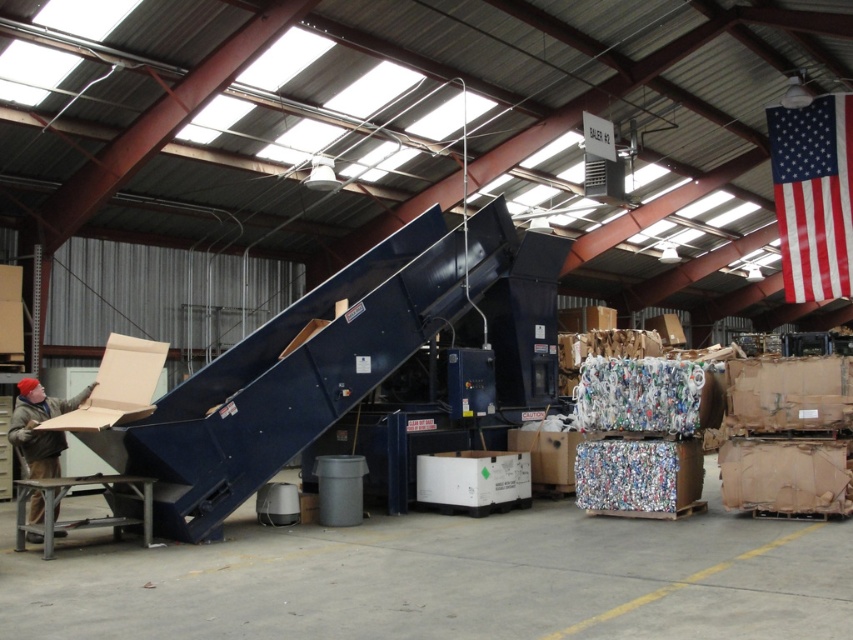
Can you confirm if red-white-and-blue fabric flag at upper right is wider than matte cardboard box at lower left?

Yes.

Consider the image. Who is lower down, red-white-and-blue fabric flag at upper right or matte cardboard box at lower left?

matte cardboard box at lower left

Between point (808, 129) and point (24, 387), which one is positioned in front?

Point (24, 387)

Locate an element on the screen. The width and height of the screenshot is (853, 640). red-white-and-blue fabric flag at upper right is located at coordinates (813, 195).